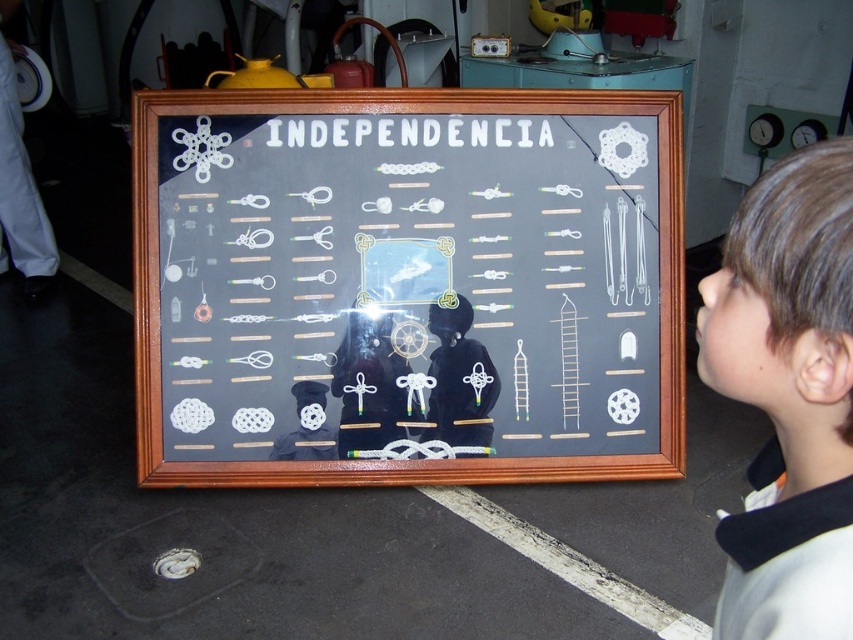
Question: Where is white paper at center located in relation to brown hair at upper right in the image?

Choices:
 (A) left
 (B) right

Answer: (A)

Question: Is white paper at center further to the viewer compared to brown hair at upper right?

Choices:
 (A) yes
 (B) no

Answer: (A)

Question: In this image, where is white paper at center located relative to brown hair at upper right?

Choices:
 (A) left
 (B) right

Answer: (A)